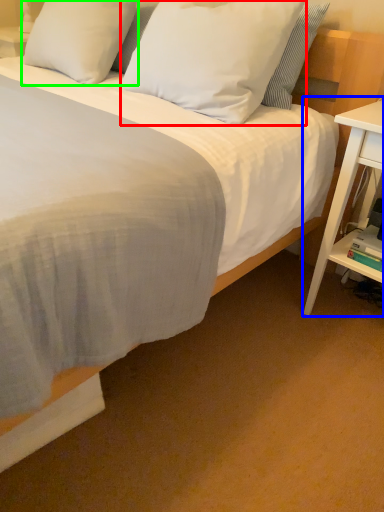
Question: Which is farther away from pillow (highlighted by a red box)? nightstand (highlighted by a blue box) or pillow (highlighted by a green box)?

Choices:
 (A) nightstand
 (B) pillow

Answer: (A)